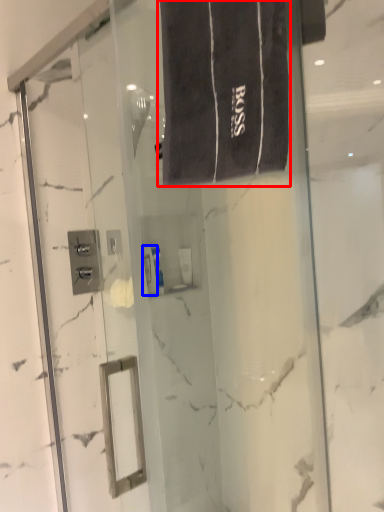
Question: Which of the following is the farthest to the observer, bath towel (highlighted by a red box) or toiletry (highlighted by a blue box)?

Choices:
 (A) bath towel
 (B) toiletry

Answer: (B)